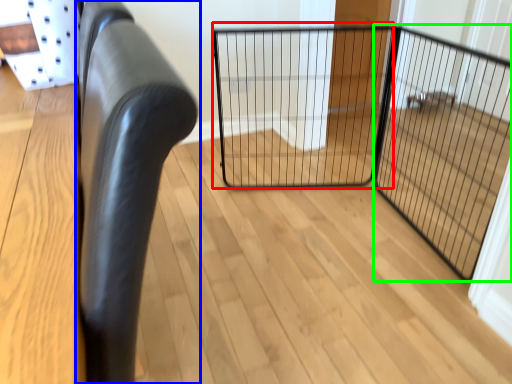
Question: Considering the real-world distances, which object is closest to cage (highlighted by a red box)? furniture (highlighted by a blue box) or screen door (highlighted by a green box).

Choices:
 (A) furniture
 (B) screen door

Answer: (B)